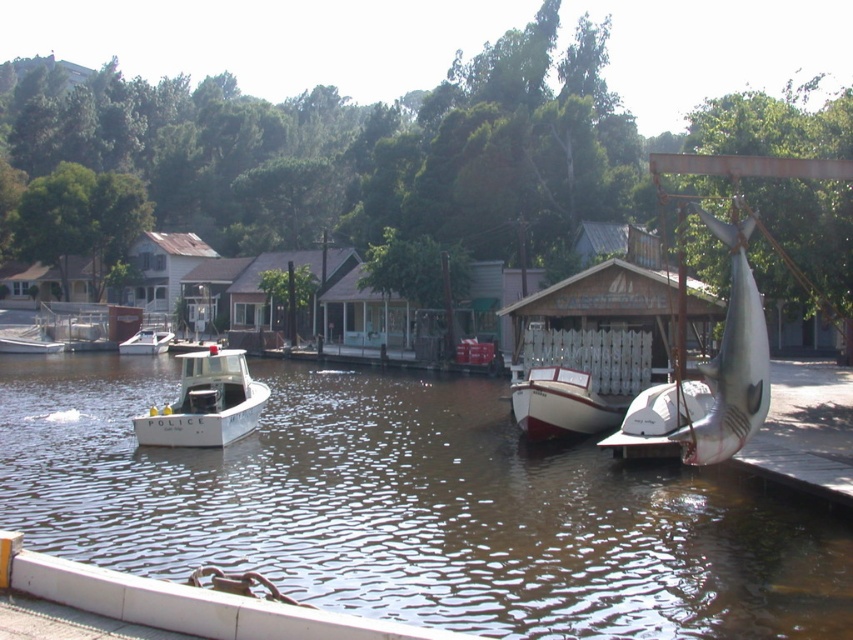
Which is behind, point (160, 410) or point (544, 428)?

The point (544, 428) is behind.

What do you see at coordinates (206, 403) in the screenshot? The width and height of the screenshot is (853, 640). I see `white matte police boat at left` at bounding box center [206, 403].

Where is `white matte police boat at left`? This screenshot has height=640, width=853. white matte police boat at left is located at coordinates (206, 403).

Is brown water at center further to the viewer compared to white matte police boat at left?

No, brown water at center is closer to the viewer.

Does point (9, 429) come farther from viewer compared to point (183, 444)?

That is True.

This screenshot has width=853, height=640. Identify the location of brown water at center. (410, 508).

Identify the location of brown water at center. The height and width of the screenshot is (640, 853). (410, 508).

Is white matte boat at center taller than white matte police boat at center?

Yes, white matte boat at center is taller than white matte police boat at center.

Can you confirm if white matte boat at center is positioned to the left of white matte police boat at center?

Incorrect, white matte boat at center is not on the left side of white matte police boat at center.

Which is behind, point (628, 397) or point (151, 333)?

The point (151, 333) is behind.

Find the location of a particular element. white matte boat at center is located at coordinates (561, 404).